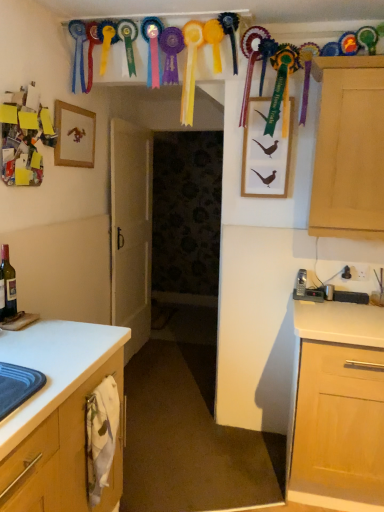
Question: In the image, is wooden picture frame at upper left, the first picture frame positioned from the left, positioned in front of or behind wooden framed picture of birds at upper center, placed as the second picture frame when sorted from left to right?

Choices:
 (A) front
 (B) behind

Answer: (A)

Question: Is point (77, 117) positioned closer to the camera than point (279, 180)?

Choices:
 (A) closer
 (B) farther

Answer: (B)

Question: Estimate the real-world distances between objects in this image. Which object is closer to the wooden picture frame at upper left, the first picture frame positioned from the left?

Choices:
 (A) matte glass bottle at left
 (B) wooden framed picture of birds at upper center, placed as the second picture frame when sorted from left to right
 (C) light wood cabinet at right
 (D) white matte door at center

Answer: (D)

Question: Which object is positioned closest to the light wood cabinet at right?

Choices:
 (A) wooden picture frame at upper left, the 2th picture frame from the right
 (B) white matte door at center
 (C) wooden framed picture of birds at upper center, placed as the second picture frame when sorted from left to right
 (D) matte glass bottle at left

Answer: (C)